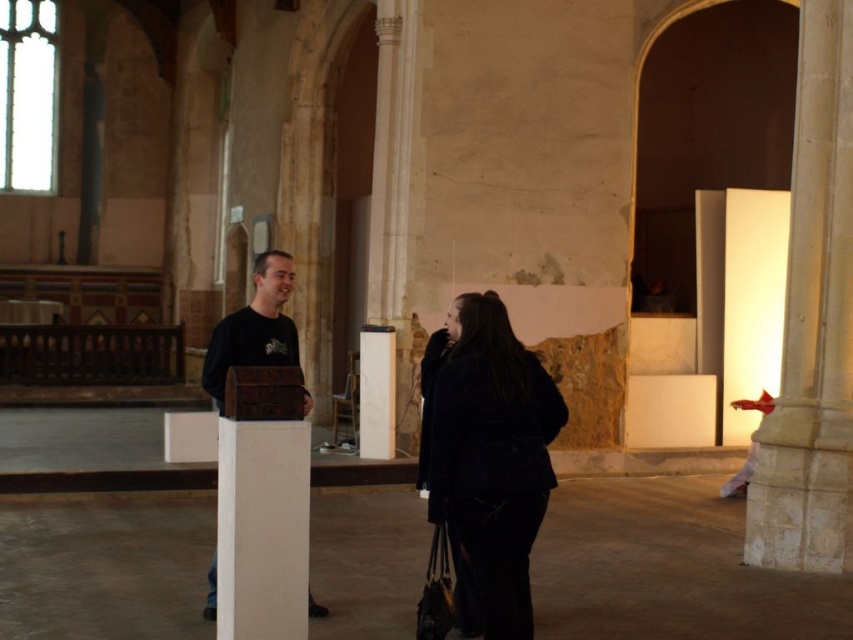
Can you confirm if dark blue wool coat at center is positioned above brown leather chest at center?

Actually, dark blue wool coat at center is below brown leather chest at center.

Who is positioned more to the right, dark blue wool coat at center or brown leather chest at center?

dark blue wool coat at center is more to the right.

You are a GUI agent. You are given a task and a screenshot of the screen. Output one action in this format:
    pyautogui.click(x=<x>, y=<y>)
    Task: Click on the dark blue wool coat at center
    The image size is (853, 640).
    Given the screenshot: What is the action you would take?
    pyautogui.click(x=486, y=460)